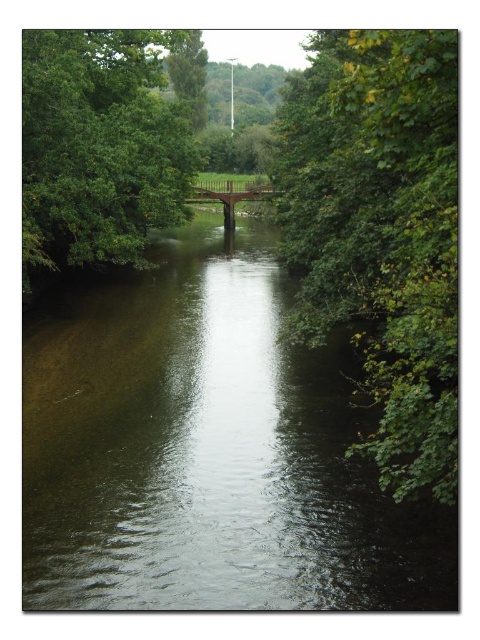
Question: Which is farther from the green leafy tree at upper center?

Choices:
 (A) brown wooden bridge at center
 (B) green leafy tree at right

Answer: (A)

Question: Is green leafy tree at upper left bigger than brown wooden bridge at center?

Choices:
 (A) no
 (B) yes

Answer: (A)

Question: Which object is farther from the camera taking this photo?

Choices:
 (A) green leafy tree at upper left
 (B) green leafy tree at upper center
 (C) clear water at center

Answer: (B)

Question: Is clear water at center to the left of green leafy tree at upper center from the viewer's perspective?

Choices:
 (A) yes
 (B) no

Answer: (B)

Question: Which of the following is the closest to the observer?

Choices:
 (A) clear water at center
 (B) green leafy tree at right
 (C) green leafy tree at upper left
 (D) brown wooden bridge at center

Answer: (B)

Question: Is clear water at center positioned in front of brown wooden bridge at center?

Choices:
 (A) no
 (B) yes

Answer: (B)